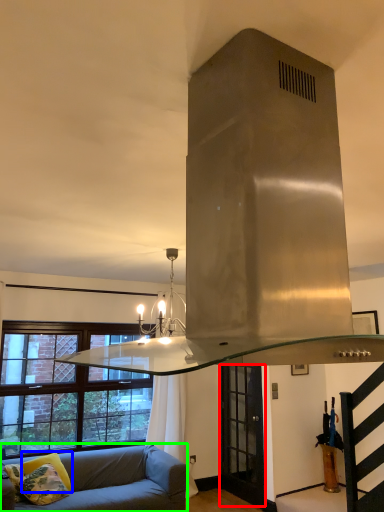
Question: Based on their relative distances, which object is farther from glass door (highlighted by a red box)? Choose from pillow (highlighted by a blue box) and studio couch (highlighted by a green box).

Choices:
 (A) pillow
 (B) studio couch

Answer: (A)